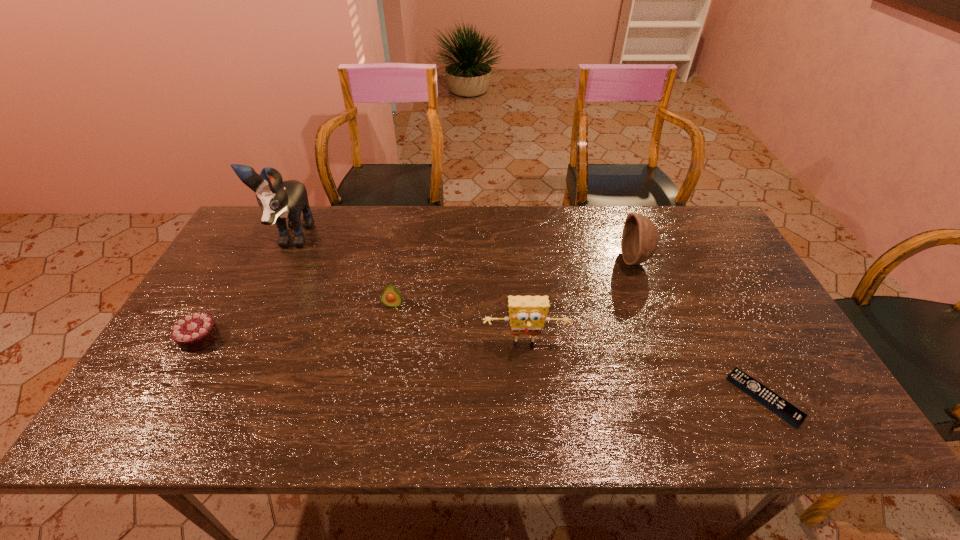
The height and width of the screenshot is (540, 960). In order to click on vacant space positioned on the front-facing side of the puppy in this screenshot , I will do `click(269, 286)`.

Locate an element on the screen. Image resolution: width=960 pixels, height=540 pixels. free point located on the left of the bowl is located at coordinates (516, 260).

Where is `vacant area located on the face of the third object from right to left`? The height and width of the screenshot is (540, 960). vacant area located on the face of the third object from right to left is located at coordinates click(528, 381).

The width and height of the screenshot is (960, 540). Find the location of `free space located 0.170m on the cut side of the third object from left to right`. free space located 0.170m on the cut side of the third object from left to right is located at coordinates (382, 361).

Identify the location of blank area located 0.390m on the right of the leftmost object. The width and height of the screenshot is (960, 540). (370, 338).

I want to click on vacant space located 0.160m on the back of the shortest object, so click(x=723, y=320).

Image resolution: width=960 pixels, height=540 pixels. I want to click on puppy situated at the far edge, so click(278, 199).

You are a GUI agent. You are given a task and a screenshot of the screen. Output one action in this format:
    pyautogui.click(x=<x>, y=<y>)
    Task: Click on the bowl that is at the far edge
    The image size is (960, 540).
    Given the screenshot: What is the action you would take?
    pyautogui.click(x=640, y=238)

The image size is (960, 540). What are the coordinates of `object located at the near edge` in the screenshot? It's located at (781, 407).

I want to click on puppy at the left edge, so click(278, 199).